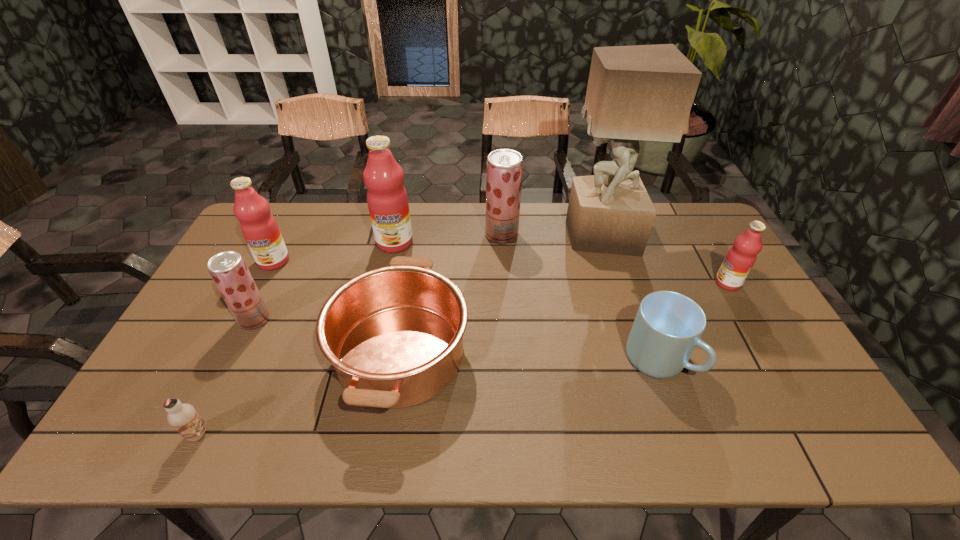
Locate an element on the screen. chocolate milk that is at the left edge is located at coordinates (183, 417).

Where is `object present at the right edge`? The width and height of the screenshot is (960, 540). object present at the right edge is located at coordinates (741, 257).

At what (x,y) coordinates should I click in order to perform the action: click on object present at the near left corner. Please return your answer as a coordinate pair (x, y). Looking at the image, I should click on (183, 417).

I want to click on free region at the far edge of the desktop, so click(436, 226).

You are a GUI agent. You are given a task and a screenshot of the screen. Output one action in this format:
    pyautogui.click(x=<x>, y=<y>)
    Task: Click on the vacant space at the near edge
    The image size is (960, 540).
    Given the screenshot: What is the action you would take?
    click(599, 447)

This screenshot has width=960, height=540. I want to click on free region at the right edge of the desktop, so click(800, 401).

What are the coordinates of `vacant area at the near left corner of the desktop` in the screenshot? It's located at (162, 436).

Find the location of `vacant space at the far right corner`. vacant space at the far right corner is located at coordinates (676, 221).

Image resolution: width=960 pixels, height=540 pixels. In order to click on free space between the saucepan and the chocolate milk in this screenshot , I will do `click(300, 394)`.

Where is `vacant space in between the nearest pink fruit juice and the saucepan`? The width and height of the screenshot is (960, 540). vacant space in between the nearest pink fruit juice and the saucepan is located at coordinates (564, 318).